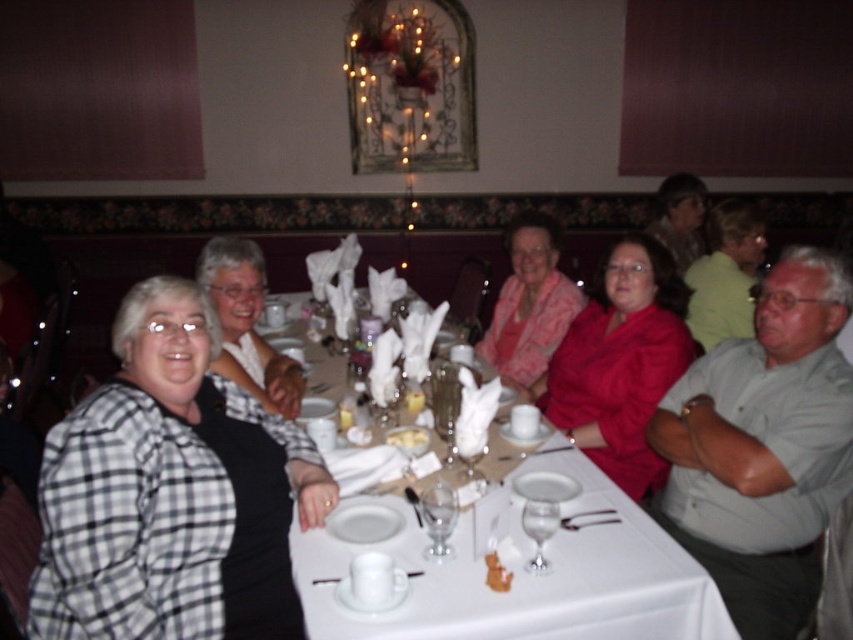
Who is more distant from viewer, (502, 289) or (699, 305)?

The point (502, 289) is more distant.

Is pink satin blouse at center to the left of matte green blouse at upper right from the viewer's perspective?

Yes, pink satin blouse at center is to the left of matte green blouse at upper right.

The image size is (853, 640). I want to click on pink satin blouse at center, so click(529, 304).

At what (x,y) coordinates should I click in order to perform the action: click on white porcelain plates at center. Please return your answer as a coordinate pair (x, y). Image resolution: width=853 pixels, height=640 pixels. Looking at the image, I should click on [527, 576].

Which is below, white porcelain plates at center or matte green blouse at upper right?

white porcelain plates at center is lower down.

Describe the element at coordinates (527, 576) in the screenshot. I see `white porcelain plates at center` at that location.

In order to click on white porcelain plates at center in this screenshot , I will do `click(527, 576)`.

Is checkered fabric jacket at left to the left of pink satin blouse at center from the viewer's perspective?

Correct, you'll find checkered fabric jacket at left to the left of pink satin blouse at center.

Does checkered fabric jacket at left appear over pink satin blouse at center?

No, checkered fabric jacket at left is not above pink satin blouse at center.

Between point (149, 406) and point (540, 333), which one is positioned behind?

Positioned behind is point (540, 333).

Locate an element on the screen. Image resolution: width=853 pixels, height=640 pixels. checkered fabric jacket at left is located at coordinates (171, 492).